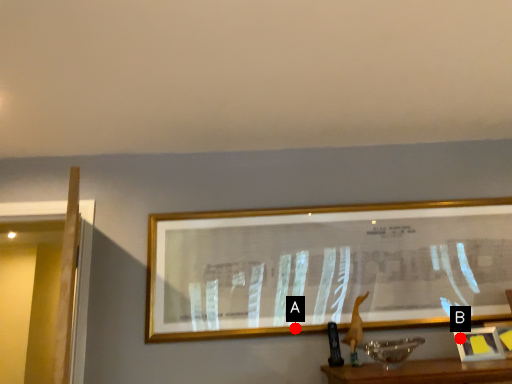
Question: Two points are circled on the image, labeled by A and B beside each circle. Among these points, which one is farthest from the camera?

Choices:
 (A) A is further
 (B) B is further

Answer: (A)